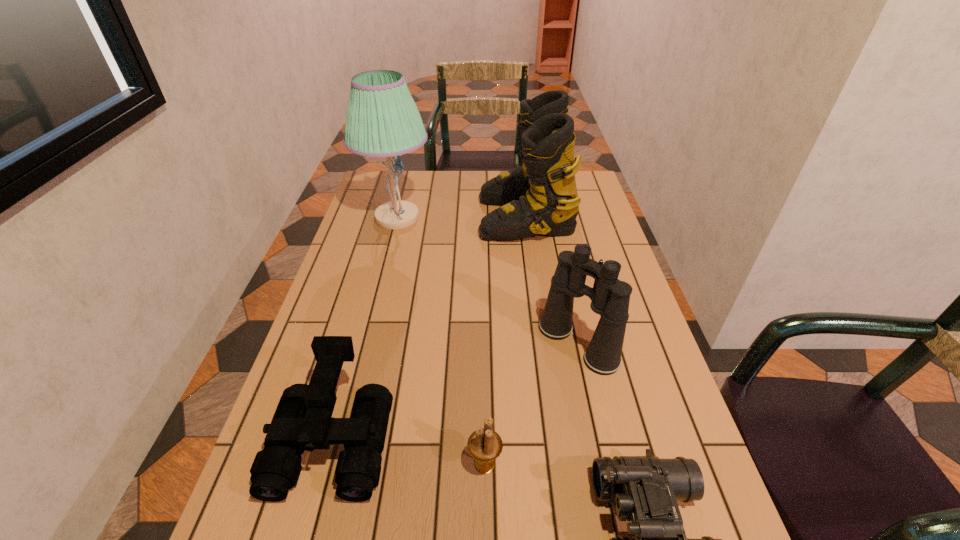
Where is `lamp`? The width and height of the screenshot is (960, 540). lamp is located at coordinates (382, 120).

What are the coordinates of `ski boots` in the screenshot? It's located at (540, 197).

Where is `the tallest binoculars`? The width and height of the screenshot is (960, 540). the tallest binoculars is located at coordinates (610, 297).

This screenshot has height=540, width=960. Identify the location of the farthest binoculars. (610, 297).

Locate an element on the screen. This screenshot has height=540, width=960. the second tallest binoculars is located at coordinates (303, 421).

Find the location of `candle holder`. candle holder is located at coordinates (484, 445).

Identify the location of vacant space located on the front of the lamp. Image resolution: width=960 pixels, height=540 pixels. (377, 296).

Find the location of a particular element. The height and width of the screenshot is (540, 960). vacant area situated on the front of the ski boots is located at coordinates (537, 298).

The height and width of the screenshot is (540, 960). Identify the location of vacant space located 0.290m on the left of the third farthest object. (430, 344).

At what (x,y) coordinates should I click in order to perform the action: click on free location located on the right of the candle holder. Please return your answer as a coordinate pair (x, y). This screenshot has height=540, width=960. Looking at the image, I should click on (598, 463).